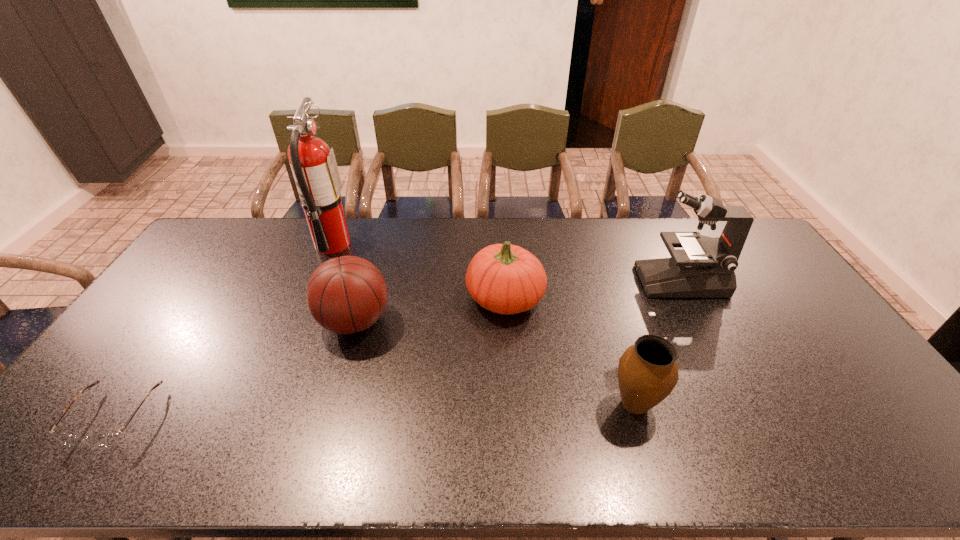
Identify the location of vacant space at the near edge. (443, 443).

Image resolution: width=960 pixels, height=540 pixels. I want to click on vacant space at the left edge, so click(176, 296).

Where is `vacant space at the right edge of the desktop`? This screenshot has width=960, height=540. vacant space at the right edge of the desktop is located at coordinates (784, 348).

This screenshot has width=960, height=540. I want to click on vacant space at the near right corner, so click(905, 466).

Identify the location of vacant area between the shortest object and the pumpkin. This screenshot has width=960, height=540. (310, 357).

I want to click on free space between the basketball and the pumpkin, so click(430, 309).

Identify the location of free space between the basketball and the spectacles. (235, 369).

Identify the location of free spot between the fifth object from left to right and the tallest object. The image size is (960, 540). (484, 324).

The width and height of the screenshot is (960, 540). I want to click on vacant area that lies between the fire extinguisher and the third object from right to left, so 419,271.

Locate an element on the screen. Image resolution: width=960 pixels, height=540 pixels. vacant region between the urn and the fire extinguisher is located at coordinates (484, 324).